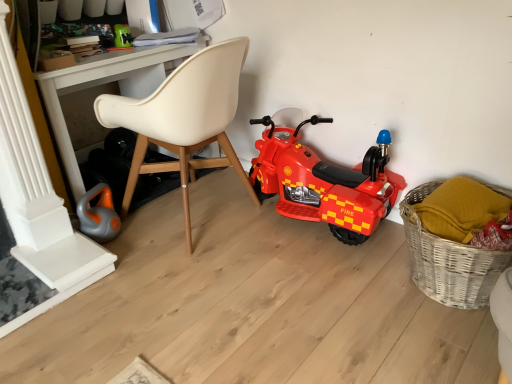
Locate an element on the screen. The height and width of the screenshot is (384, 512). vacant area that lies between beige leather chair at center and woven wicker basket at lower right is located at coordinates (319, 268).